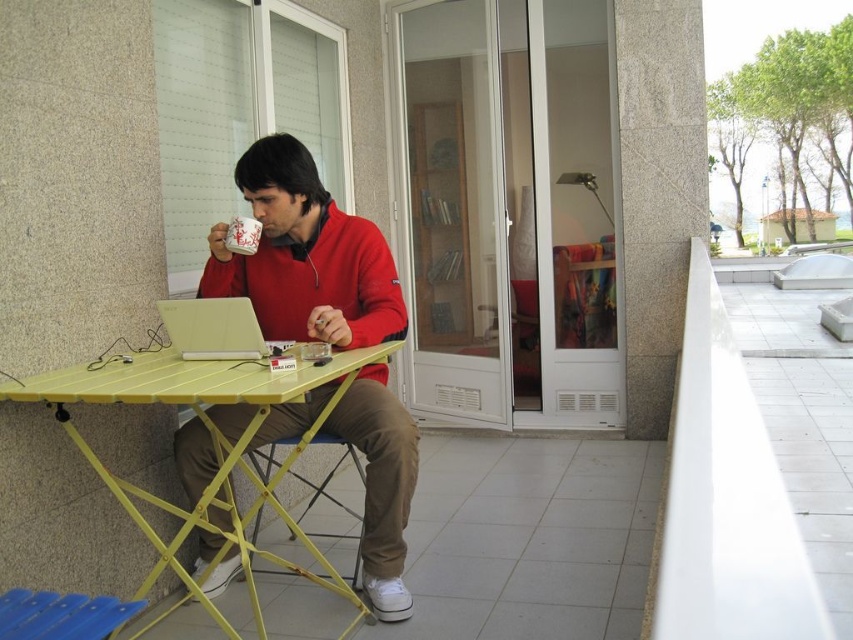
Question: Can you confirm if yellow plastic table at center is positioned above white plastic laptop at center?

Choices:
 (A) no
 (B) yes

Answer: (A)

Question: Which point appears closest to the camera in this image?

Choices:
 (A) (227, 349)
 (B) (280, 394)

Answer: (B)

Question: Considering the real-world distances, which object is farthest from the white plastic laptop at center?

Choices:
 (A) yellow plastic table at center
 (B) matte red sweater at center

Answer: (B)

Question: Based on their relative distances, which object is nearer to the yellow plastic table at center?

Choices:
 (A) white plastic laptop at center
 (B) matte red sweater at center

Answer: (B)

Question: Is matte red sweater at center bigger than white plastic laptop at center?

Choices:
 (A) no
 (B) yes

Answer: (B)

Question: Is yellow plastic table at center bigger than white plastic laptop at center?

Choices:
 (A) no
 (B) yes

Answer: (B)